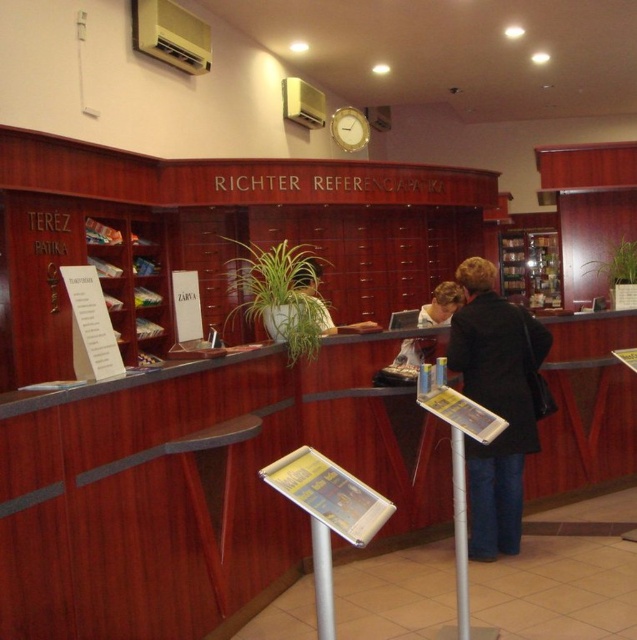
You are a visitor in the Richter Referenciapati and need to locate the two silver metallic poles. Which one is bigger between the metallic silver pole at center and the silver metallic pole at lower center?

The metallic silver pole at center is larger in size than the silver metallic pole at lower center.

You are standing in front of the wooden desk at center in the Richter Referenciapati reference section. You need to reach a book that is placed on the desk. Considering your arm length is 2.5 feet, can you reach the book without moving closer?

The wooden desk at center is 5.79 feet away from the camera. Since your arm length is only 2.5 feet, you cannot reach the book on the wooden desk at center without moving closer.